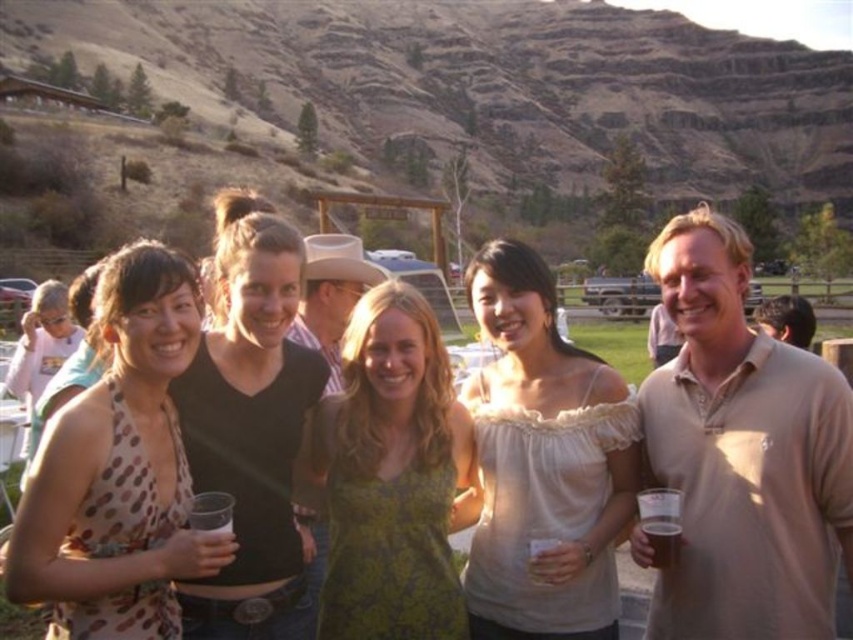
Question: Which object is positioned closest to the white lace top at center?

Choices:
 (A) brown leather cowboy hat at center
 (B) matte black shirt at center

Answer: (A)

Question: Is matte black shirt at center to the right of matte plastic cup at center from the viewer's perspective?

Choices:
 (A) no
 (B) yes

Answer: (A)

Question: Considering the real-world distances, which object is farthest from the translucent plastic cup at lower right?

Choices:
 (A) matte black shirt at center
 (B) beige cotton polo shirt at right

Answer: (A)

Question: Is white lace top at center to the right of translucent plastic cup at lower right from the viewer's perspective?

Choices:
 (A) yes
 (B) no

Answer: (B)

Question: Can you confirm if brown polka dot fabric dress at left is positioned to the right of brown leather cowboy hat at center?

Choices:
 (A) no
 (B) yes

Answer: (A)

Question: Which point is closer to the camera?

Choices:
 (A) (318, 588)
 (B) (671, 557)
 (C) (245, 273)

Answer: (B)